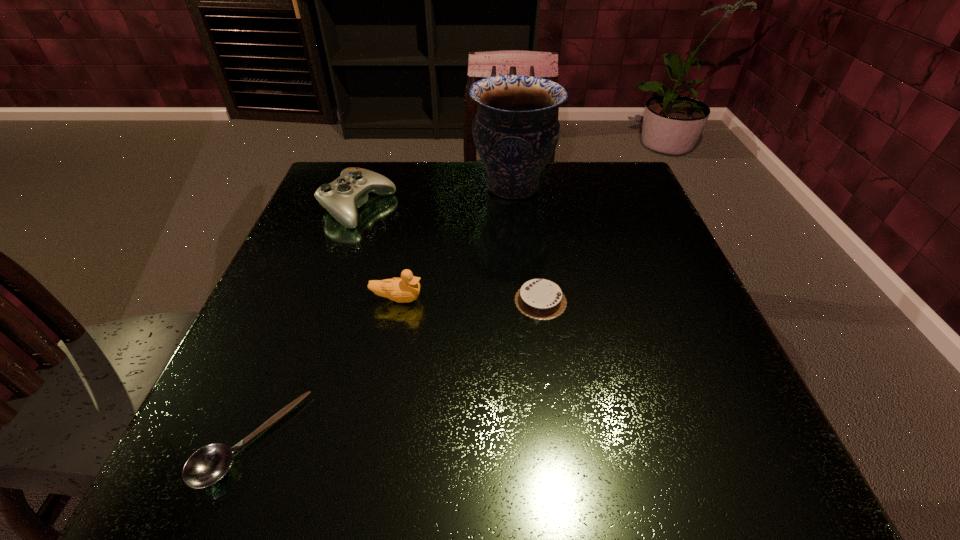
Locate an element on the screen. Image resolution: width=960 pixels, height=540 pixels. blank area in the image that satisfies the following two spatial constraints: 1. on the front handle of the pottery; 2. on the right side of the chocolate cake is located at coordinates (524, 301).